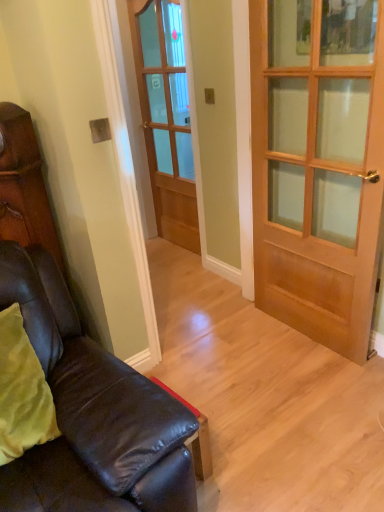
Question: From a real-world perspective, is matte brown cabinet at left on wooden glass door at center, which is counted as the second door, starting from the right?

Choices:
 (A) no
 (B) yes

Answer: (B)

Question: Is matte brown cabinet at left beside wooden glass door at center, the first door in the left-to-right sequence?

Choices:
 (A) yes
 (B) no

Answer: (B)

Question: Can you confirm if matte brown cabinet at left is smaller than wooden glass door at center, the first door in the left-to-right sequence?

Choices:
 (A) no
 (B) yes

Answer: (B)

Question: From the image's perspective, would you say matte brown cabinet at left is positioned over wooden glass door at center, the first door from the back?

Choices:
 (A) no
 (B) yes

Answer: (A)

Question: Does matte brown cabinet at left have a lesser height compared to wooden glass door at center, the first door from the back?

Choices:
 (A) yes
 (B) no

Answer: (A)

Question: Are matte brown cabinet at left and wooden glass door at center, the first door from the back, located far from each other?

Choices:
 (A) yes
 (B) no

Answer: (A)

Question: Can you confirm if wooden door at center, arranged as the first door when viewed from the front, is thinner than matte brown cabinet at left?

Choices:
 (A) yes
 (B) no

Answer: (A)

Question: From a real-world perspective, is wooden door at center, which is counted as the first door, starting from the right, positioned under matte brown cabinet at left based on gravity?

Choices:
 (A) no
 (B) yes

Answer: (B)

Question: From the image's perspective, is wooden door at center, which is counted as the first door, starting from the right, located beneath matte brown cabinet at left?

Choices:
 (A) no
 (B) yes

Answer: (A)

Question: Does wooden door at center, which is counted as the first door, starting from the right, have a smaller size compared to matte brown cabinet at left?

Choices:
 (A) no
 (B) yes

Answer: (A)

Question: Is matte brown cabinet at left completely or partially inside wooden door at center, which is counted as the first door, starting from the right?

Choices:
 (A) no
 (B) yes

Answer: (A)

Question: Does wooden door at center, placed as the 2th door when sorted from left to right, have a greater height compared to matte brown cabinet at left?

Choices:
 (A) no
 (B) yes

Answer: (B)

Question: Does wooden glass door at center, positioned as the 2th door in front-to-back order, lie behind leather couch at lower left?

Choices:
 (A) no
 (B) yes

Answer: (B)